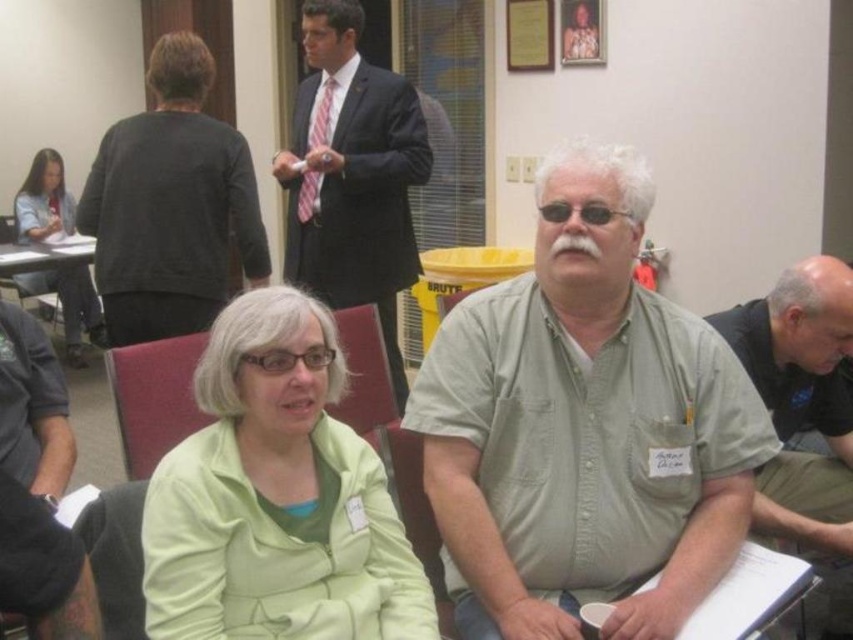
Is gray shirt at center to the left of wooden chair at left from the viewer's perspective?

No, gray shirt at center is not to the left of wooden chair at left.

The height and width of the screenshot is (640, 853). In order to click on gray shirt at center in this screenshot , I will do `click(801, 397)`.

This screenshot has width=853, height=640. In order to click on gray shirt at center in this screenshot , I will do `click(801, 397)`.

Does green cotton shirt at center appear over matte black jacket at left?

No, green cotton shirt at center is not above matte black jacket at left.

From the picture: Who is more forward, (611,550) or (44,150)?

Positioned in front is point (611,550).

Identify the location of green cotton shirt at center. (584, 428).

Can you confirm if green zip-up jacket at center is taller than dark gray sweater at upper left?

No, green zip-up jacket at center is not taller than dark gray sweater at upper left.

Does point (190, 572) come farther from viewer compared to point (178, 116)?

No, it is not.

Is point (281, 582) closer to viewer compared to point (207, 209)?

That is True.

Locate an element on the screen. green zip-up jacket at center is located at coordinates (276, 497).